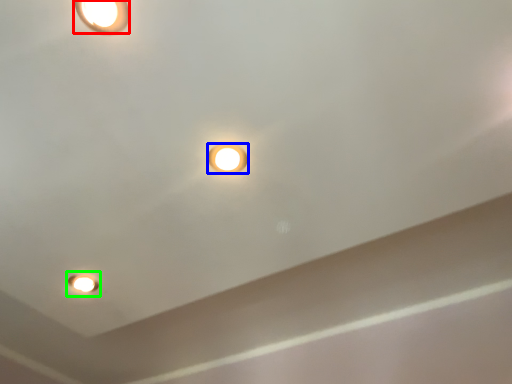
Question: Which is farther away from lamp (highlighted by a red box)? lamp (highlighted by a blue box) or light fixture (highlighted by a green box)?

Choices:
 (A) lamp
 (B) light fixture

Answer: (B)